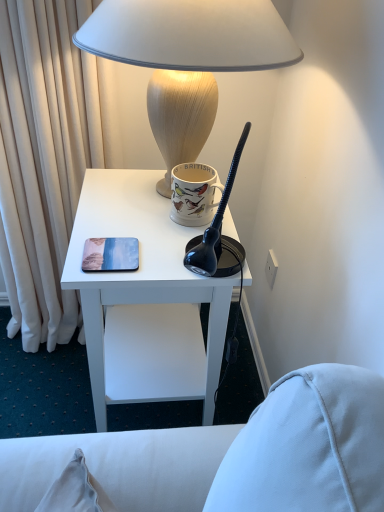
Question: Considering the positions of matte plastic coaster at center left and matte beige lamp at upper center in the image, is matte plastic coaster at center left bigger or smaller than matte beige lamp at upper center?

Choices:
 (A) small
 (B) big

Answer: (A)

Question: Is matte plastic coaster at center left in front of or behind matte beige lamp at upper center in the image?

Choices:
 (A) behind
 (B) front

Answer: (A)

Question: Which of these objects is positioned closest to the white matte desk at center?

Choices:
 (A) matte beige lamp at upper center
 (B) matte plastic coaster at center left
 (C) matte ceramic mug at upper center

Answer: (B)

Question: Estimate the real-world distances between objects in this image. Which object is farther from the matte beige lamp at upper center?

Choices:
 (A) white matte desk at center
 (B) matte plastic coaster at center left
 (C) matte ceramic mug at upper center

Answer: (A)